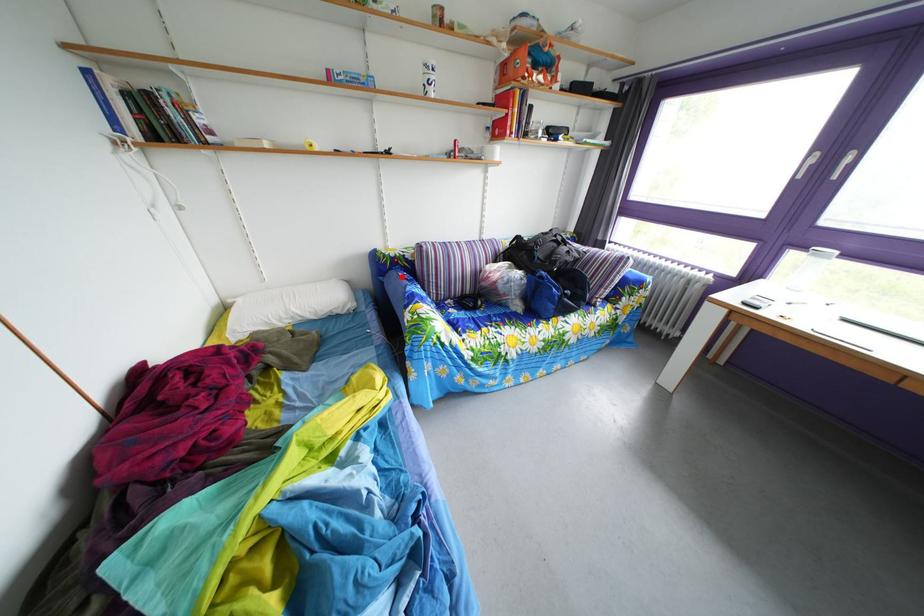
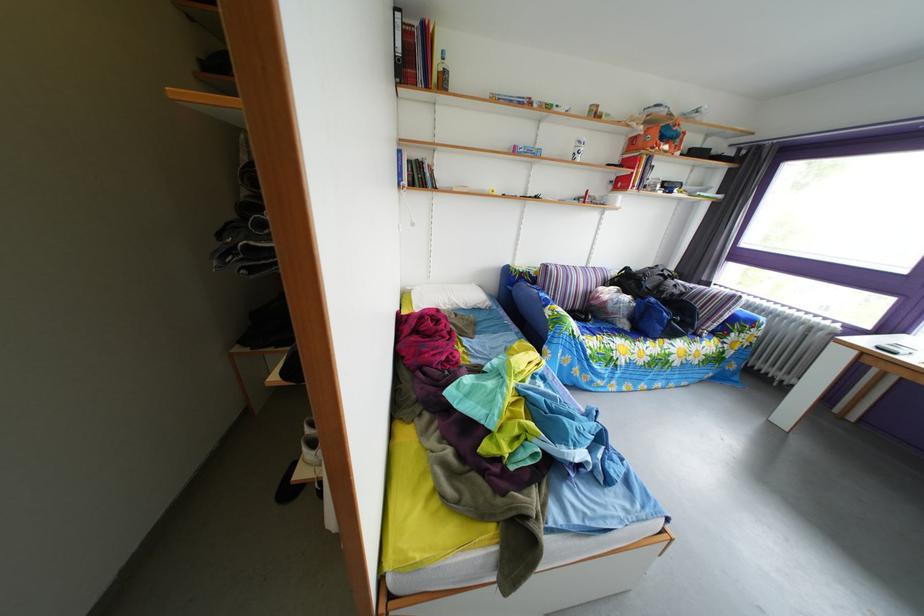
In the second image, find the point that corresponds to the highlighted location in the first image.

(529, 289)